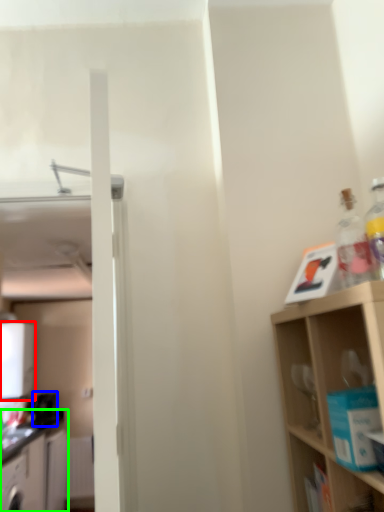
Question: Based on their relative distances, which object is nearer to appliance (highlighted by a red box)? Choose from appliance (highlighted by a blue box) and cabinetry (highlighted by a green box).

Choices:
 (A) appliance
 (B) cabinetry

Answer: (A)